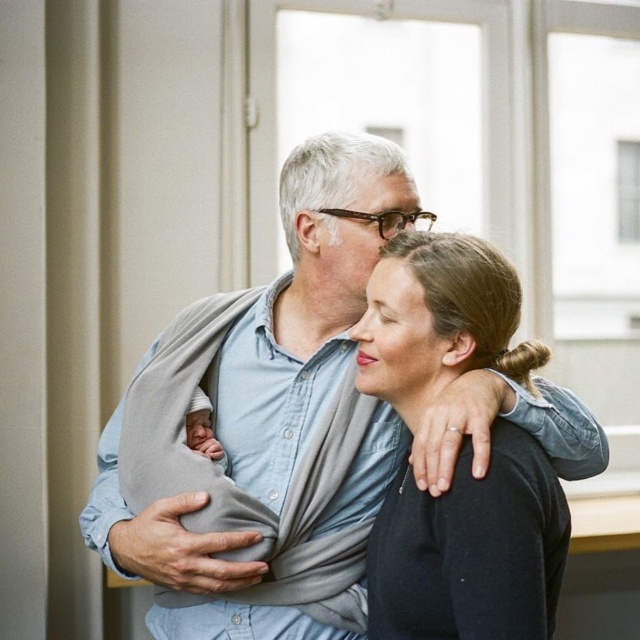
Who is positioned more to the right, gray fabric baby carrier at center or black matte hair at center?

From the viewer's perspective, black matte hair at center appears more on the right side.

Who is higher up, gray fabric baby carrier at center or black matte hair at center?

gray fabric baby carrier at center

Does point (476, 420) come closer to viewer compared to point (484, 628)?

No, (476, 420) is further to viewer.

Image resolution: width=640 pixels, height=640 pixels. I want to click on gray fabric baby carrier at center, so click(x=307, y=305).